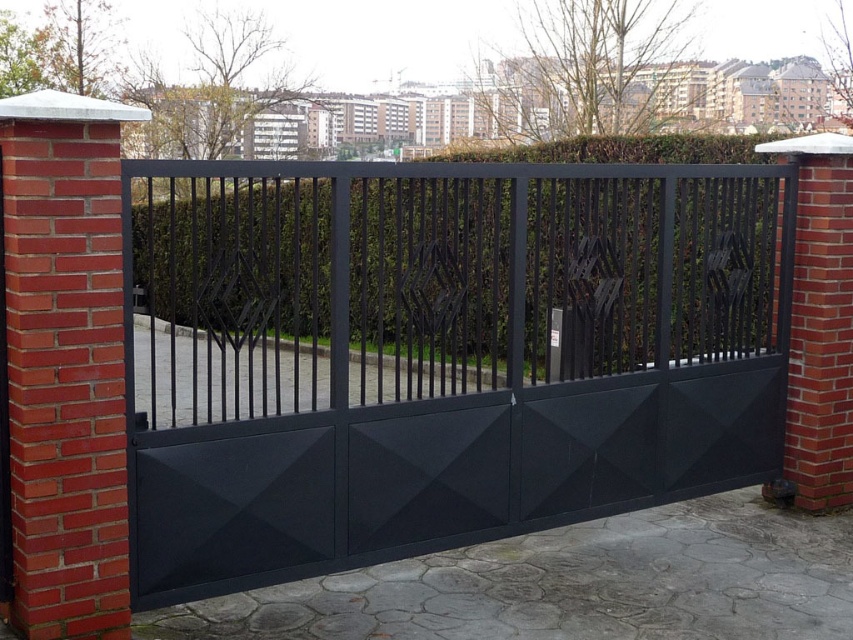
In the scene shown: You are a delivery person approaching the property. You see the matte black gate at center and the green leafy hedge at center. Which object is closer to you as you approach the entrance?

The matte black gate at center is closer to you because it is positioned in front of the green leafy hedge at center.

You are standing at the entrance of the property and want to reach the point marked at coordinates point (335, 477). If your stride length is 2.5 feet per step, how many steps will it take you to reach that point?

The point (335, 477) is 12.67 feet away from the viewer. Dividing the distance by the stride length of 2.5 feet per step gives approximately 5.07 steps. Since you can only take whole steps, you would need to take 6 steps to reach the point.